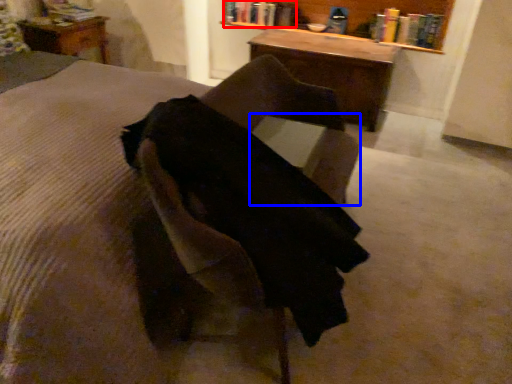
Question: Which of the following is the farthest to the observer, book (highlighted by a red box) or table (highlighted by a blue box)?

Choices:
 (A) book
 (B) table

Answer: (A)